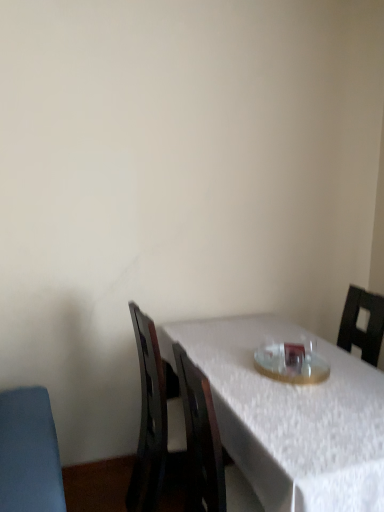
Question: Is clear glass plate at center facing away from white textured table at center?

Choices:
 (A) no
 (B) yes

Answer: (A)

Question: Considering the relative sizes of clear glass plate at center and white textured table at center in the image provided, is clear glass plate at center smaller than white textured table at center?

Choices:
 (A) no
 (B) yes

Answer: (B)

Question: Can you confirm if clear glass plate at center is thinner than white textured table at center?

Choices:
 (A) no
 (B) yes

Answer: (B)

Question: Can you confirm if clear glass plate at center is taller than white textured table at center?

Choices:
 (A) no
 (B) yes

Answer: (A)

Question: Can you confirm if clear glass plate at center is wider than white textured table at center?

Choices:
 (A) no
 (B) yes

Answer: (A)

Question: From a real-world perspective, is clear glass plate at center over white textured table at center?

Choices:
 (A) yes
 (B) no

Answer: (A)

Question: Considering the relative sizes of white textured table at center and clear glass plate at center in the image provided, is white textured table at center bigger than clear glass plate at center?

Choices:
 (A) yes
 (B) no

Answer: (A)

Question: Is white textured table at center oriented away from clear glass plate at center?

Choices:
 (A) no
 (B) yes

Answer: (A)

Question: Is white textured table at center shorter than clear glass plate at center?

Choices:
 (A) no
 (B) yes

Answer: (A)

Question: Can you confirm if white textured table at center is positioned to the left of clear glass plate at center?

Choices:
 (A) no
 (B) yes

Answer: (B)

Question: Is white textured table at center facing towards clear glass plate at center?

Choices:
 (A) yes
 (B) no

Answer: (B)

Question: Is the position of white textured table at center less distant than that of clear glass plate at center?

Choices:
 (A) yes
 (B) no

Answer: (A)

Question: In terms of height, does white textured table at center look taller or shorter compared to clear glass plate at center?

Choices:
 (A) short
 (B) tall

Answer: (B)